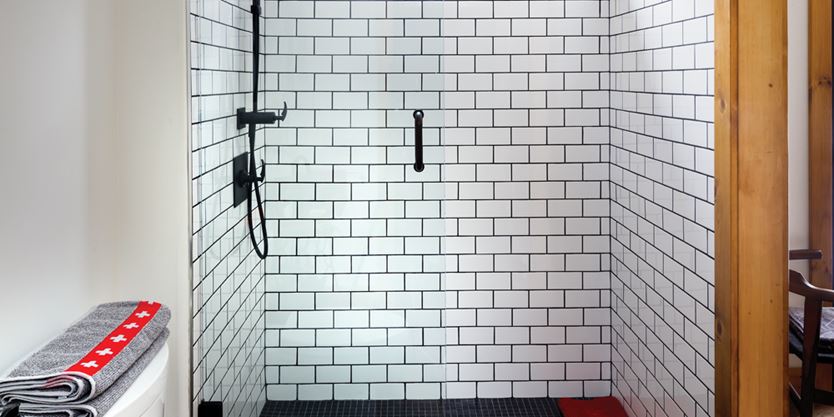
This screenshot has height=417, width=834. Find the location of `back wall`. back wall is located at coordinates (224, 276), (384, 279).